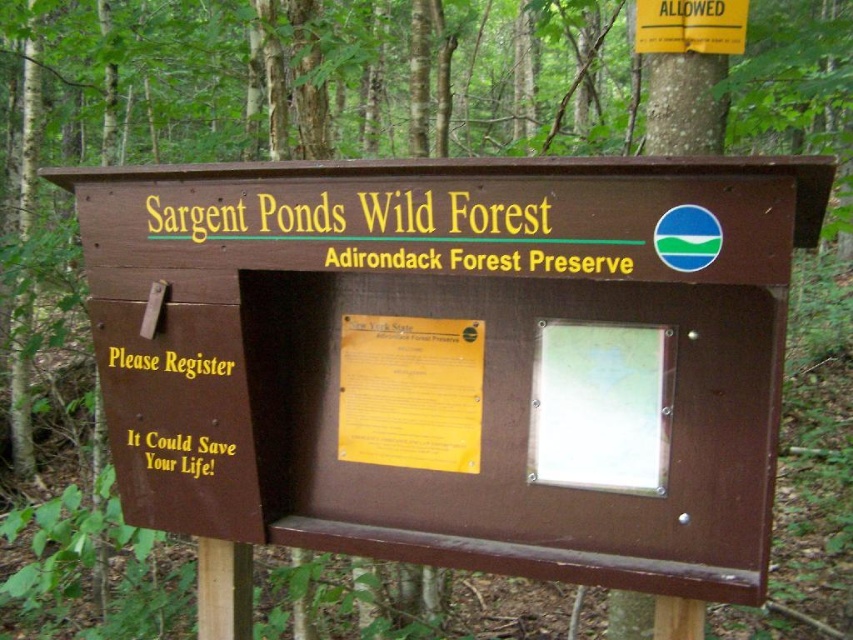
Is brown wood sign at center to the left of yellow metallic text at lower left from the viewer's perspective?

In fact, brown wood sign at center is to the right of yellow metallic text at lower left.

Does point (283, 499) come in front of point (213, 461)?

That is False.

Describe the element at coordinates (454, 337) in the screenshot. This screenshot has width=853, height=640. I see `brown wood sign at center` at that location.

At what (x,y) coordinates should I click in order to perform the action: click on brown wood sign at center. Please return your answer as a coordinate pair (x, y). Looking at the image, I should click on (454, 337).

Does point (407, 368) come closer to viewer compared to point (154, 362)?

No, (407, 368) is further to viewer.

The height and width of the screenshot is (640, 853). In order to click on yellow paper at center in this screenshot , I will do `click(410, 392)`.

Image resolution: width=853 pixels, height=640 pixels. I want to click on yellow paper at center, so click(x=410, y=392).

Is yellow metallic text at lower left behind yellowmaterial/texturetext at center?

Yes, yellow metallic text at lower left is further from the viewer.

Consider the image. Is yellow metallic text at lower left thinner than yellowmaterial/texturetext at center?

Correct, yellow metallic text at lower left's width is less than yellowmaterial/texturetext at center's.

Locate an element on the screen. yellow metallic text at lower left is located at coordinates (180, 451).

At what (x,y) coordinates should I click in order to perform the action: click on yellow metallic text at lower left. Please return your answer as a coordinate pair (x, y). Looking at the image, I should click on (180, 451).